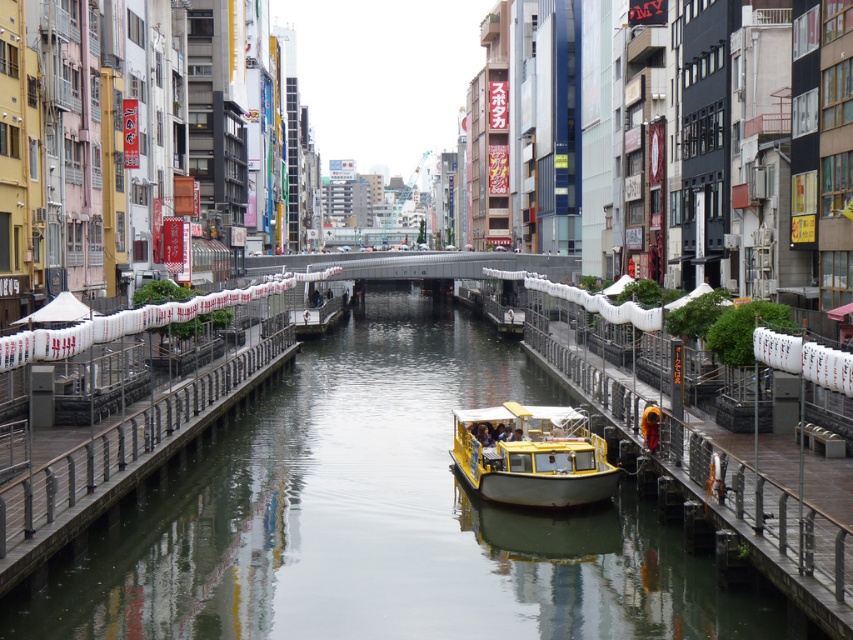
Question: Is smooth concrete river at center behind wooden rail at left?

Choices:
 (A) yes
 (B) no

Answer: (A)

Question: Considering the real-world distances, which object is farthest from the yellow matte boat at center?

Choices:
 (A) smooth concrete river at center
 (B) wooden rail at left

Answer: (B)

Question: Which object is positioned farthest from the wooden rail at left?

Choices:
 (A) yellow matte boat at center
 (B) smooth concrete river at center

Answer: (A)

Question: Is smooth concrete river at center to the right of wooden rail at left from the viewer's perspective?

Choices:
 (A) yes
 (B) no

Answer: (A)

Question: Which point appears farthest from the camera in this image?

Choices:
 (A) (236, 369)
 (B) (511, 419)

Answer: (A)

Question: Is wooden rail at left thinner than yellow matte boat at center?

Choices:
 (A) yes
 (B) no

Answer: (A)